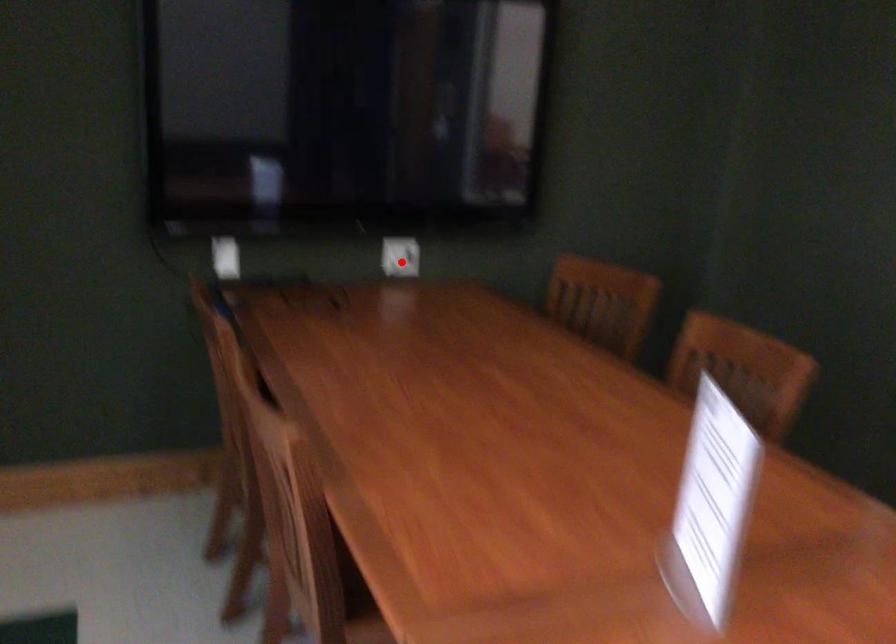
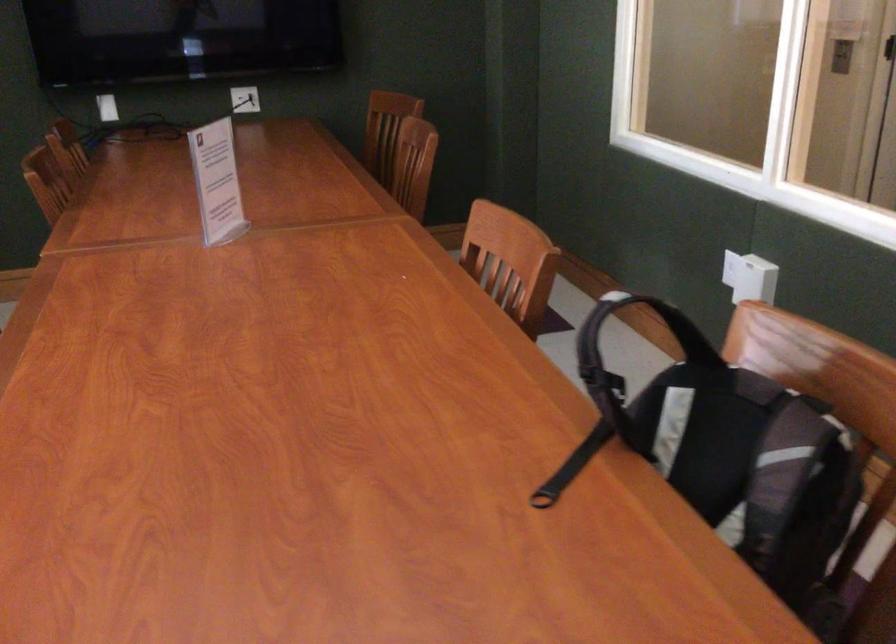
Question: I am providing you with two images of the same scene from different viewpoints. Given a red point in image1, look at the same physical point in image2. Is it:

Choices:
 (A) Closer to the viewpoint
 (B) Farther from the viewpoint

Answer: (B)